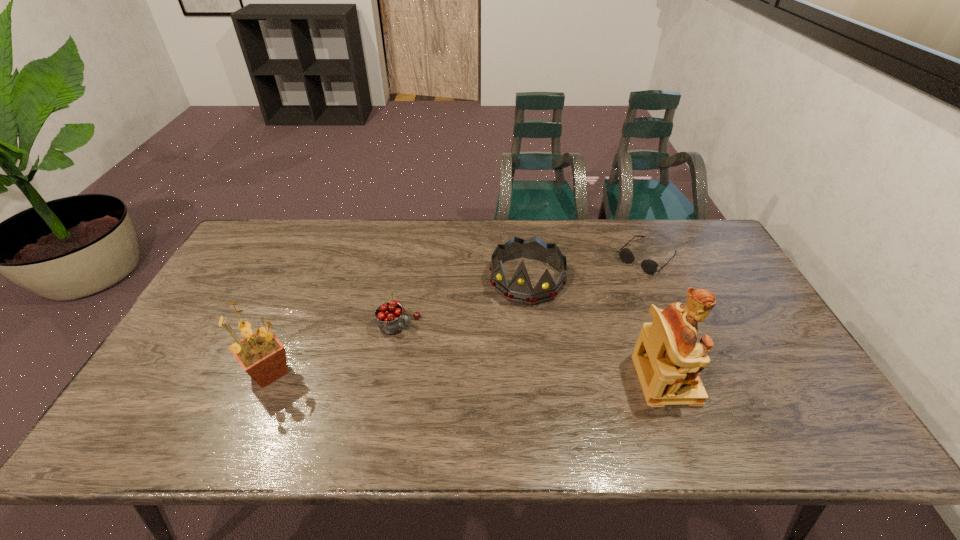
At what (x,y) coordinates should I click in order to perform the action: click on free space between the leftmost object and the shortest object. Please return your answer as a coordinate pair (x, y). The width and height of the screenshot is (960, 540). Looking at the image, I should click on (458, 315).

The height and width of the screenshot is (540, 960). I want to click on vacant space that is in between the leftmost object and the fourth object from right to left, so click(334, 348).

Locate an element on the screen. The image size is (960, 540). free space between the figurine and the third tallest object is located at coordinates (596, 329).

Image resolution: width=960 pixels, height=540 pixels. Identify the location of unoccupied area between the pot filled with cherries and the tiara. (463, 301).

The width and height of the screenshot is (960, 540). Identify the location of vacant region between the sunflower and the second object from left to right. (334, 348).

Locate an element on the screen. free space that is in between the fourth object from right to left and the tallest object is located at coordinates (532, 350).

Find the location of a particular element. The width and height of the screenshot is (960, 540). the fourth closest object to the tallest object is located at coordinates (263, 357).

In order to click on object that is the closest to the third object from right to left in this screenshot , I will do `click(649, 266)`.

Locate an element on the screen. This screenshot has width=960, height=540. vacant space that satisfies the following two spatial constraints: 1. at the front of the tallest object with flowers visible; 2. on the front-facing side of the fourth shortest object is located at coordinates (267, 379).

Find the location of a particular element. vacant space that satisfies the following two spatial constraints: 1. on the back side of the pot filled with cherries; 2. on the left side of the third object from left to right is located at coordinates (406, 280).